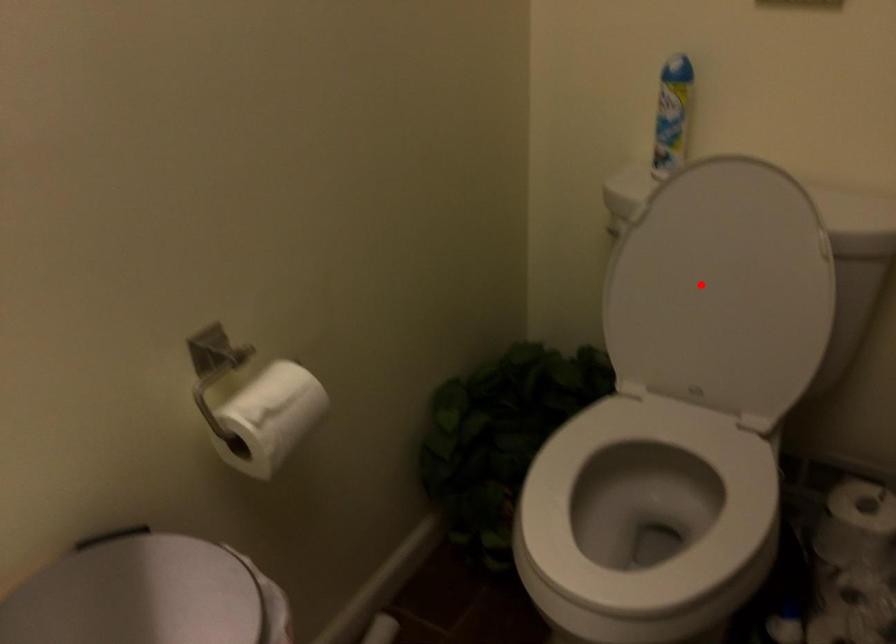
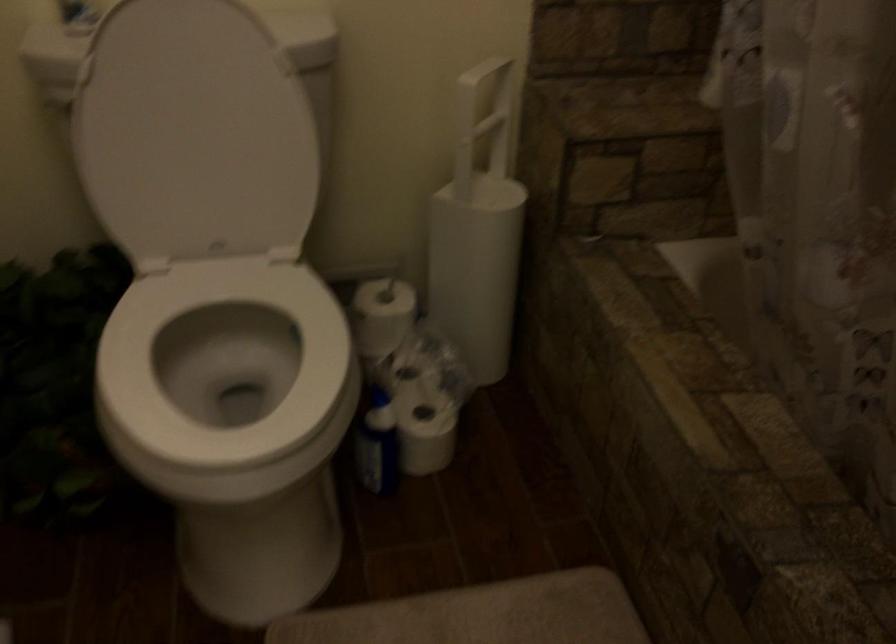
In the second image, find the point that corresponds to the highlighted location in the first image.

(194, 134)